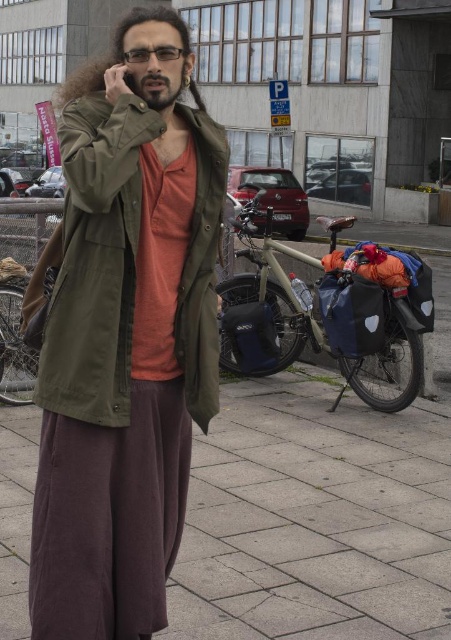
Does point (285, 540) lie in front of point (78, 314)?

No.

Is gray concrete pavement at center to the right of olive green fabric jacket at center from the viewer's perspective?

Correct, you'll find gray concrete pavement at center to the right of olive green fabric jacket at center.

Who is more forward, (275, 410) or (133, 122)?

Point (133, 122) is more forward.

I want to click on gray concrete pavement at center, so click(x=314, y=516).